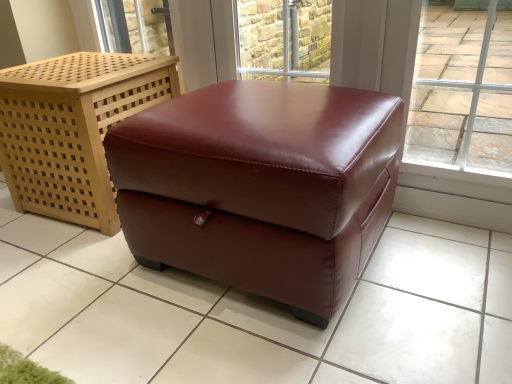
Find the location of a particular element. This screenshot has height=384, width=512. glossy leather ottoman at center is located at coordinates (261, 186).

Find the location of a particular element. The width and height of the screenshot is (512, 384). glossy leather ottoman at center is located at coordinates (261, 186).

Identify the location of furniture behind the glossy leather ottoman at center. (73, 129).

Which is correct: burgundy leather ottoman at center is inside glossy leather ottoman at center, or outside of it?

burgundy leather ottoman at center is spatially situated outside glossy leather ottoman at center.

Between burgundy leather ottoman at center and glossy leather ottoman at center, which one has more height?

With more height is burgundy leather ottoman at center.

From the image's perspective, between burgundy leather ottoman at center and glossy leather ottoman at center, who is located below?

glossy leather ottoman at center appears lower in the image.

In the scene shown: Are glossy leather ottoman at center and brick wall at upper center making contact?

They are not placed beside each other.

Identify the location of table below the brick wall at upper center (from the image's perspective). This screenshot has height=384, width=512. (261, 186).

From the image's perspective, relative to brick wall at upper center, is glossy leather ottoman at center above or below?

From the image's perspective, glossy leather ottoman at center appears below brick wall at upper center.

The width and height of the screenshot is (512, 384). I want to click on furniture on the left of brick wall at upper center, so click(73, 129).

Which object is wider, brick wall at upper center or burgundy leather ottoman at center?

With larger width is burgundy leather ottoman at center.

Based on their positions, is brick wall at upper center located to the left or right of burgundy leather ottoman at center?

Based on their positions, brick wall at upper center is located to the right of burgundy leather ottoman at center.

How many degrees apart are the facing directions of brick wall at upper center and burgundy leather ottoman at center?

The angular difference between brick wall at upper center and burgundy leather ottoman at center is 2.8 degrees.

Considering the points (234, 11) and (159, 216), which point is behind, point (234, 11) or point (159, 216)?

Point (234, 11)

From a real-world perspective, is brick wall at upper center positioned above or below glossy leather ottoman at center?

In terms of real-world spatial position, brick wall at upper center is above glossy leather ottoman at center.

Is brick wall at upper center in front of or behind glossy leather ottoman at center in the image?

Clearly, brick wall at upper center is behind glossy leather ottoman at center.

Considering the relative sizes of burgundy leather ottoman at center and brick wall at upper center in the image provided, is burgundy leather ottoman at center smaller than brick wall at upper center?

No.

Is burgundy leather ottoman at center oriented towards brick wall at upper center?

No, burgundy leather ottoman at center is not oriented towards brick wall at upper center.

In the scene shown: Is burgundy leather ottoman at center in front of or behind brick wall at upper center in the image?

burgundy leather ottoman at center is in front of brick wall at upper center.

From a real-world perspective, who is located lower, burgundy leather ottoman at center or brick wall at upper center?

burgundy leather ottoman at center is physically lower.

What's the angular difference between glossy leather ottoman at center and burgundy leather ottoman at center's facing directions?

There is a 2.61-degree angle between the facing directions of glossy leather ottoman at center and burgundy leather ottoman at center.

Is glossy leather ottoman at center directly adjacent to burgundy leather ottoman at center?

glossy leather ottoman at center and burgundy leather ottoman at center are not in contact.

In the scene shown: Does glossy leather ottoman at center turn towards burgundy leather ottoman at center?

No, glossy leather ottoman at center is not facing towards burgundy leather ottoman at center.

Considering the relative positions of glossy leather ottoman at center and burgundy leather ottoman at center in the image provided, is glossy leather ottoman at center to the right of burgundy leather ottoman at center from the viewer's perspective?

Correct, you'll find glossy leather ottoman at center to the right of burgundy leather ottoman at center.

This screenshot has height=384, width=512. I want to click on furniture above the glossy leather ottoman at center (from the image's perspective), so click(x=73, y=129).

You are a GUI agent. You are given a task and a screenshot of the screen. Output one action in this format:
    pyautogui.click(x=<x>, y=<y>)
    Task: Click on the window on the right of glossy leather ottoman at center
    Image resolution: width=512 pixels, height=384 pixels.
    Given the screenshot: What is the action you would take?
    pyautogui.click(x=283, y=39)

When comparing their distances from glossy leather ottoman at center, does burgundy leather ottoman at center or brick wall at upper center seem further?

The object further to glossy leather ottoman at center is brick wall at upper center.

Looking at the image, which one is located further to burgundy leather ottoman at center, brick wall at upper center or glossy leather ottoman at center?

The object further to burgundy leather ottoman at center is brick wall at upper center.

From the image, which object appears to be farther from brick wall at upper center, glossy leather ottoman at center or burgundy leather ottoman at center?

glossy leather ottoman at center lies further to brick wall at upper center than the other object.

In the scene shown: From the image, which object appears to be farther from burgundy leather ottoman at center, glossy leather ottoman at center or brick wall at upper center?

brick wall at upper center is positioned further to the anchor burgundy leather ottoman at center.

When comparing their distances from brick wall at upper center, does burgundy leather ottoman at center or glossy leather ottoman at center seem closer?

burgundy leather ottoman at center lies closer to brick wall at upper center than the other object.

When comparing their distances from glossy leather ottoman at center, does brick wall at upper center or burgundy leather ottoman at center seem closer?

Among the two, burgundy leather ottoman at center is located nearer to glossy leather ottoman at center.

Identify the location of table between burgundy leather ottoman at center and brick wall at upper center. (261, 186).